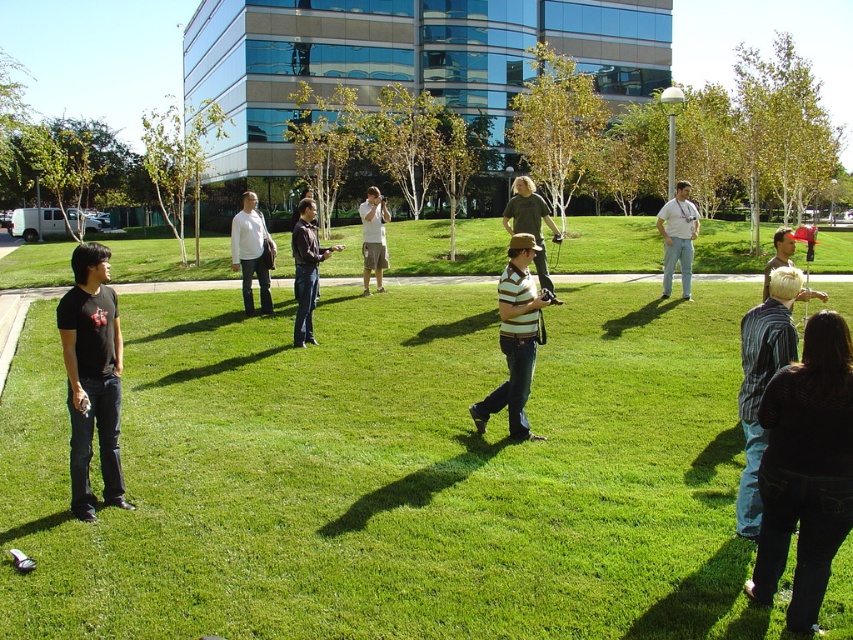
Does light brown cotton shirt at center lie behind light brown hair at lower right?

Yes.

Between point (381, 241) and point (781, 266), which one is positioned in front?

Point (781, 266) is in front.

Identify the location of light brown cotton shirt at center. The image size is (853, 640). (373, 237).

What do you see at coordinates (306, 269) in the screenshot? I see `dark brown shirt at center` at bounding box center [306, 269].

Who is more distant from viewer, (299, 257) or (790, 234)?

The point (299, 257) is behind.

Is point (299, 333) more distant than point (776, 250)?

Yes, point (299, 333) is behind point (776, 250).

This screenshot has width=853, height=640. In order to click on dark brown shirt at center in this screenshot , I will do `click(306, 269)`.

The width and height of the screenshot is (853, 640). What do you see at coordinates (251, 252) in the screenshot?
I see `white shirt at center` at bounding box center [251, 252].

Can you confirm if white shirt at center is bigger than light brown cotton shirt at center?

Yes.

What are the coordinates of `white shirt at center` in the screenshot? It's located at (251, 252).